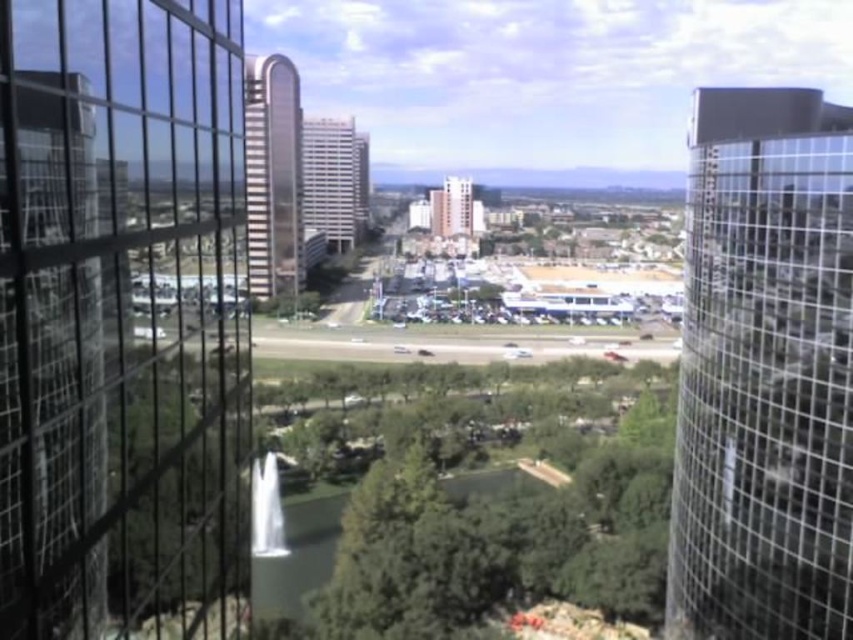
You are standing at the center of the image and want to locate the clear glass tower at right. In which direction should you look to see it?

You should look to the right to see the clear glass tower at right since it is located at the right side of the image.

You are an architect designing a new sculpture that needs to be placed between the green leafy tree at center and the smooth glass building at center. Considering their heights, which object should the sculpture be closer to?

The sculpture should be closer to the green leafy tree at center because it is shorter than the smooth glass building at center, as stated in the description.

You are standing at the observation deck of the building and want to take a photo that includes both the green leafy tree at center and the white glass building at center. Which object will appear smaller in the photo?

The green leafy tree at center will appear smaller in the photo because it is not as tall as the white glass building at center.